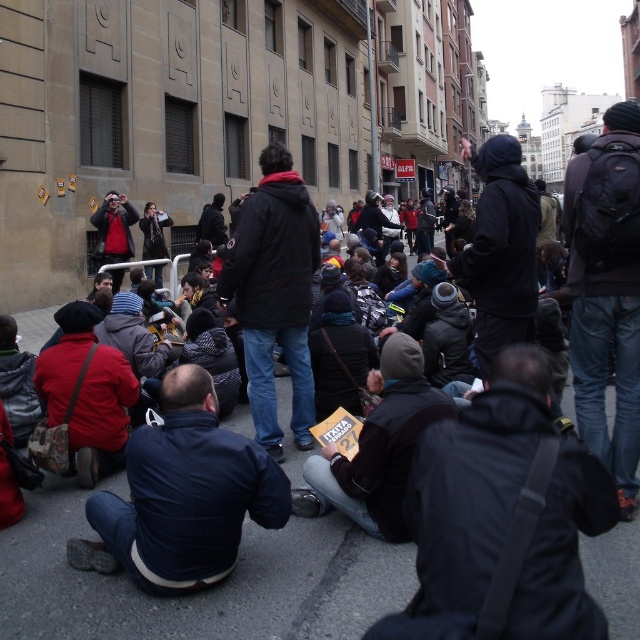
Consider the image. You are standing at point (522, 554) and want to take a photo of the crowd. There is a camera 3.75 meters away from you. Is the camera within the recommended 4 meters range for capturing clear photos of the crowd?

The camera is 3.75 meters away from you at point (522, 554), which is within the recommended 4 meters range for capturing clear photos of the crowd.

You are a photographer trying to capture a wide shot of the crowd in the street scene. You need to ensure that both the dark gray asphalt at center and the black leather jacket at lower center are visible in the frame. Given their sizes, which object will occupy more space in your photo?

The dark gray asphalt at center will occupy more space in the photo because its width is larger than that of the black leather jacket at lower center.

You are a delivery robot with a 60 cm wide package. You need to move from the dark gray asphalt at center to the dark blue puffy jacket at lower left. Can you fit through the space between them?

The dark gray asphalt at center and dark blue puffy jacket at lower left are 94.13 centimeters apart from each other. Since the package is 60 cm wide, the robot can fit through the space between them as 94.13 cm is wider than 60 cm.